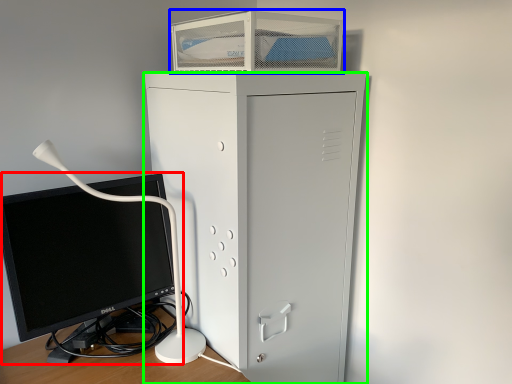
Question: Which is farther away from computer monitor (highlighted by a red box)? desktop (highlighted by a blue box) or furniture (highlighted by a green box)?

Choices:
 (A) desktop
 (B) furniture

Answer: (A)